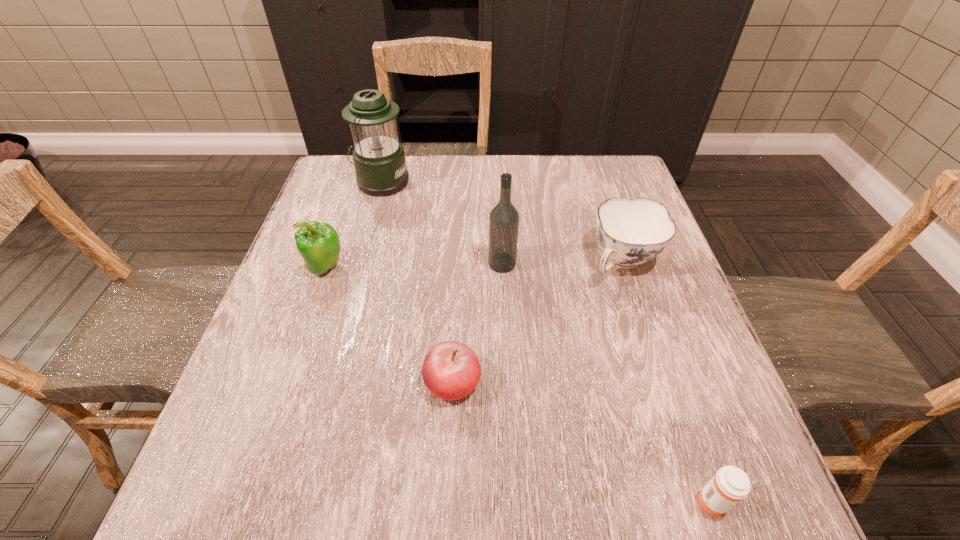
At what (x,y) coordinates should I click in order to perform the action: click on lantern. Please return your answer as a coordinate pair (x, y). Looking at the image, I should click on (379, 160).

Find the location of a particular element. This screenshot has height=540, width=960. vodka is located at coordinates click(504, 218).

Where is `bell pepper`? The width and height of the screenshot is (960, 540). bell pepper is located at coordinates (318, 243).

Identify the location of the fourth tallest object. (631, 231).

Image resolution: width=960 pixels, height=540 pixels. Find the location of `the third object from left to right`. the third object from left to right is located at coordinates (451, 370).

The image size is (960, 540). I want to click on the second nearest object, so click(x=451, y=370).

Identify the location of medicine. (730, 484).

Locate an element on the screen. free region located 0.380m on the front of the farthest object is located at coordinates (348, 306).

Where is `vacant space located 0.090m on the right of the vodka`? The height and width of the screenshot is (540, 960). vacant space located 0.090m on the right of the vodka is located at coordinates (555, 264).

This screenshot has height=540, width=960. I want to click on vacant space located on the back of the third tallest object, so click(x=345, y=214).